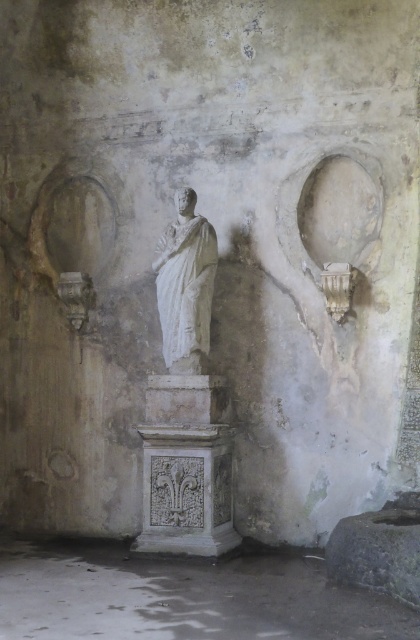
Question: Which point is closer to the camera taking this photo?

Choices:
 (A) (189, 420)
 (B) (36, 572)
 (C) (212, 285)

Answer: (B)

Question: Among these objects, which one is farthest from the camera?

Choices:
 (A) white marble statue at center
 (B) white marble pedestal at center
 (C) white marble pedestal at lower center

Answer: (A)

Question: From the image, what is the correct spatial relationship of white marble pedestal at lower center in relation to white marble pedestal at center?

Choices:
 (A) below
 (B) above

Answer: (A)

Question: Is white marble pedestal at lower center bigger than white marble pedestal at center?

Choices:
 (A) no
 (B) yes

Answer: (B)

Question: In this image, where is white marble pedestal at center located relative to white marble statue at center?

Choices:
 (A) left
 (B) right

Answer: (B)

Question: Estimate the real-world distances between objects in this image. Which object is farther from the white marble pedestal at center?

Choices:
 (A) white marble pedestal at lower center
 (B) white marble statue at center

Answer: (A)